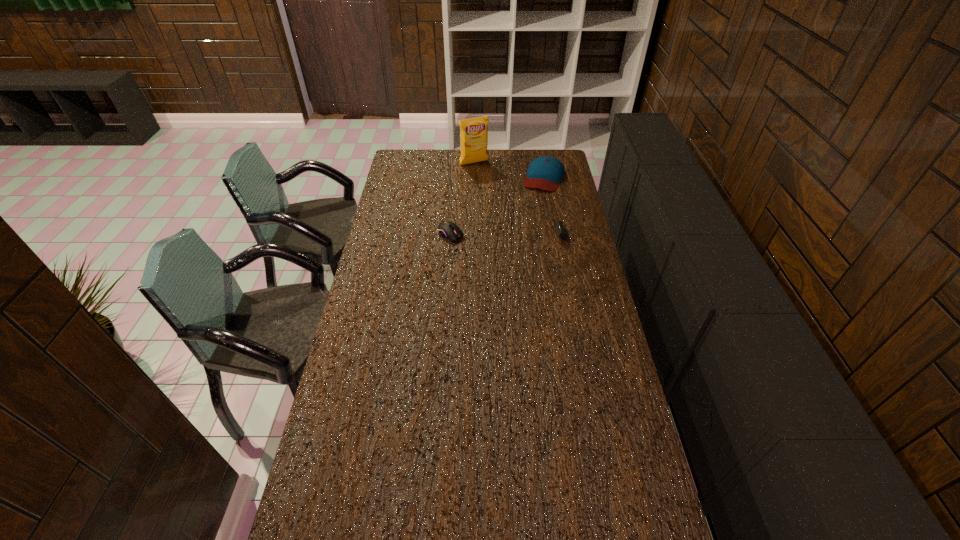
At what (x,y) coordinates should I click in order to perform the action: click on vacant space on the desktop that is between the computer mouse and the webcam and is positioned on the front of the tallest object with the logo. Please return your answer as a coordinate pair (x, y). The height and width of the screenshot is (540, 960). Looking at the image, I should click on (522, 234).

In order to click on vacant spot on the desktop that is between the computer mouse and the webcam and is positioned with the bill of the baseball cap facing forward in this screenshot , I will do `click(520, 234)`.